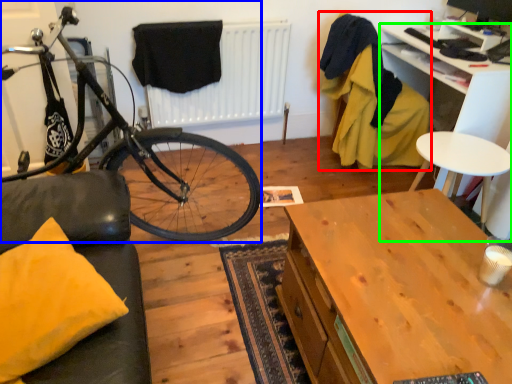
Question: Based on their relative distances, which object is nearer to armchair (highlighted by a red box)? Choose from bicycle (highlighted by a blue box) and desk (highlighted by a green box).

Choices:
 (A) bicycle
 (B) desk

Answer: (B)